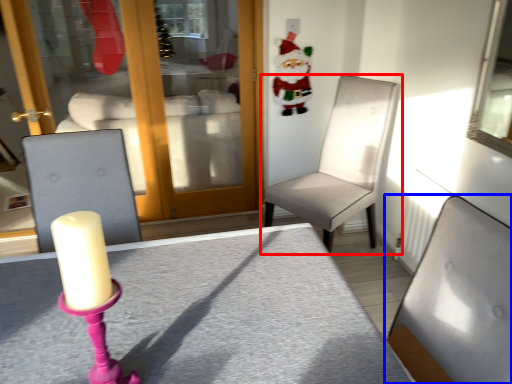
Question: Which object appears closest to the camera in this image, chair (highlighted by a red box) or chair (highlighted by a blue box)?

Choices:
 (A) chair
 (B) chair

Answer: (B)